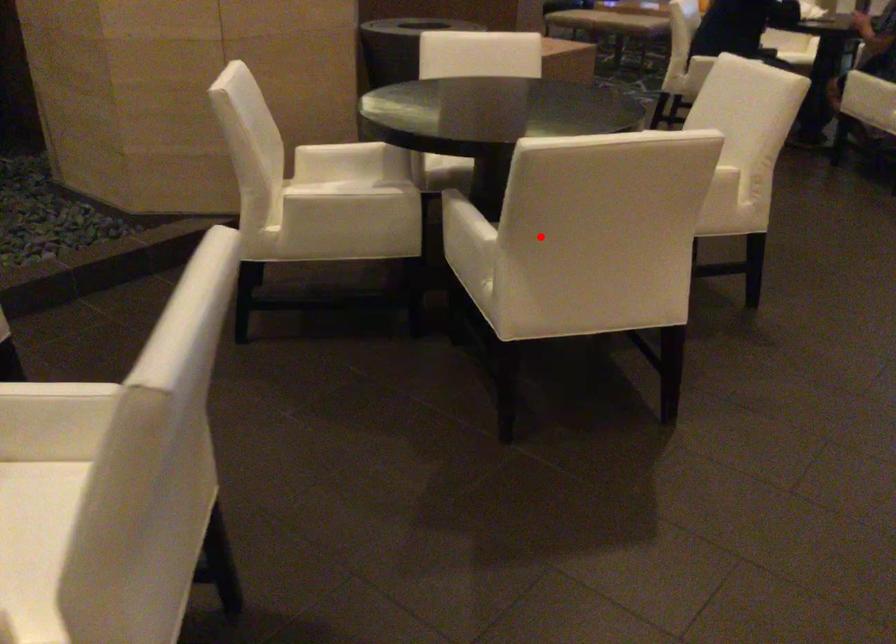
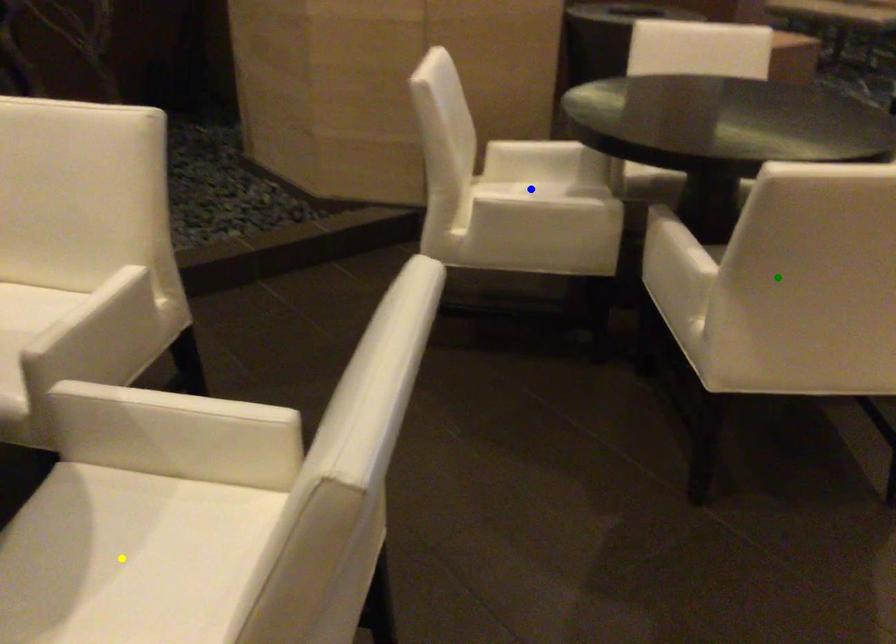
Question: I am providing you with two images of the same scene from different viewpoints. A red point is marked on the first image. You are given multiple points on the second image. Which mark in image 2 goes with the point in image 1?

Choices:
 (A) blue point
 (B) green point
 (C) yellow point

Answer: (B)